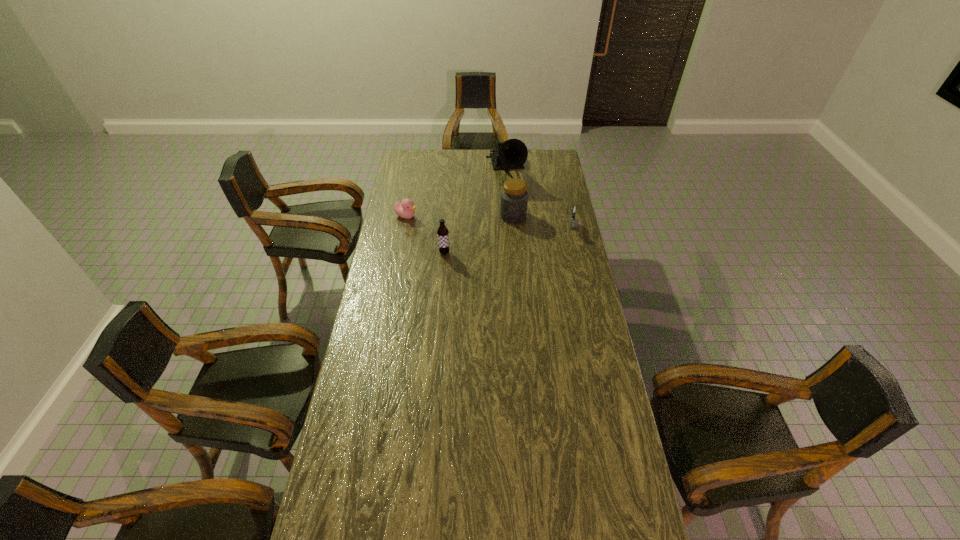
This screenshot has width=960, height=540. I want to click on free space on the desktop that is between the root beer and the igniter and is positioned on the front-facing side of the shortest object, so click(x=501, y=242).

The height and width of the screenshot is (540, 960). In order to click on free space on the desktop that is between the root beer and the rightmost object and is positioned from the horn of the farthest object in this screenshot , I will do `click(523, 238)`.

Where is `vacant space on the desktop that is between the fourth object from right to left and the rightmost object and is positioned on the surface of the jar near the warning symbol`? vacant space on the desktop that is between the fourth object from right to left and the rightmost object and is positioned on the surface of the jar near the warning symbol is located at coordinates (501, 242).